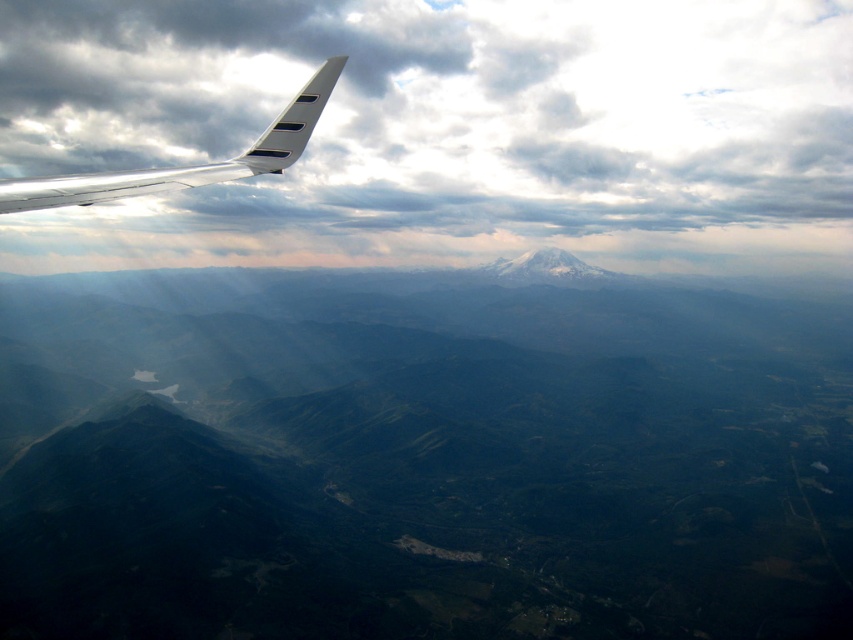
Which is in front, point (68, 563) or point (312, 100)?

Positioned in front is point (312, 100).

Find the location of a particular element. This screenshot has width=853, height=640. green textured mountains at center is located at coordinates (421, 456).

Image resolution: width=853 pixels, height=640 pixels. What do you see at coordinates (421, 456) in the screenshot?
I see `green textured mountains at center` at bounding box center [421, 456].

Which is in front, point (463, 481) or point (294, 145)?

Point (294, 145) is more forward.

Where is `green textured mountains at center`? green textured mountains at center is located at coordinates (421, 456).

This screenshot has width=853, height=640. I want to click on green textured mountains at center, so click(421, 456).

Is green textured mountains at center shorter than cloudy sky at upper center?

Yes.

Between green textured mountains at center and cloudy sky at upper center, which one appears on the right side from the viewer's perspective?

From the viewer's perspective, cloudy sky at upper center appears more on the right side.

The height and width of the screenshot is (640, 853). Describe the element at coordinates (421, 456) in the screenshot. I see `green textured mountains at center` at that location.

You are a GUI agent. You are given a task and a screenshot of the screen. Output one action in this format:
    pyautogui.click(x=<x>, y=<y>)
    Task: Click on the green textured mountains at center
    
    Given the screenshot: What is the action you would take?
    pyautogui.click(x=421, y=456)